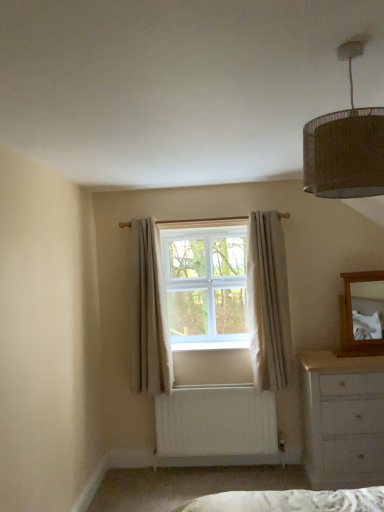
Question: Is the position of wooden mirror at right less distant than that of white plastic window at center?

Choices:
 (A) yes
 (B) no

Answer: (A)

Question: From a real-world perspective, is wooden mirror at right physically below white plastic window at center?

Choices:
 (A) yes
 (B) no

Answer: (A)

Question: Is wooden mirror at right bigger than white plastic window at center?

Choices:
 (A) no
 (B) yes

Answer: (A)

Question: Is wooden mirror at right aimed at white plastic window at center?

Choices:
 (A) no
 (B) yes

Answer: (A)

Question: Considering the relative sizes of wooden mirror at right and white plastic window at center in the image provided, is wooden mirror at right thinner than white plastic window at center?

Choices:
 (A) yes
 (B) no

Answer: (A)

Question: Is light beige fabric curtain at center, acting as the second curtain starting from the right, in front of or behind white textured curtain at center, which is counted as the 2th curtain, starting from the left, in the image?

Choices:
 (A) behind
 (B) front

Answer: (A)

Question: Looking at their shapes, would you say light beige fabric curtain at center, positioned as the 1th curtain in left-to-right order, is wider or thinner than white textured curtain at center, the first curtain viewed from the right?

Choices:
 (A) wide
 (B) thin

Answer: (A)

Question: From the image's perspective, is light beige fabric curtain at center, acting as the second curtain starting from the right, positioned above or below white textured curtain at center, which is counted as the 2th curtain, starting from the left?

Choices:
 (A) below
 (B) above

Answer: (A)

Question: Considering the positions of light beige fabric curtain at center, acting as the second curtain starting from the right, and white textured curtain at center, which is counted as the 2th curtain, starting from the left, in the image, is light beige fabric curtain at center, acting as the second curtain starting from the right, bigger or smaller than white textured curtain at center, which is counted as the 2th curtain, starting from the left,?

Choices:
 (A) small
 (B) big

Answer: (B)

Question: In the image, is braided wicker lampshade at upper right positioned in front of or behind light beige fabric curtain at center, acting as the second curtain starting from the right?

Choices:
 (A) front
 (B) behind

Answer: (A)

Question: Considering the positions of point (314, 136) and point (150, 366), is point (314, 136) closer or farther from the camera than point (150, 366)?

Choices:
 (A) closer
 (B) farther

Answer: (A)

Question: Is braided wicker lampshade at upper right inside the boundaries of light beige fabric curtain at center, positioned as the 1th curtain in left-to-right order, or outside?

Choices:
 (A) inside
 (B) outside

Answer: (B)

Question: Is braided wicker lampshade at upper right taller or shorter than light beige fabric curtain at center, acting as the second curtain starting from the right?

Choices:
 (A) short
 (B) tall

Answer: (A)

Question: Considering their positions, is white painted wood chest of drawers at lower right located in front of or behind white textured curtain at center, the first curtain viewed from the right?

Choices:
 (A) behind
 (B) front

Answer: (B)

Question: In terms of height, does white painted wood chest of drawers at lower right look taller or shorter compared to white textured curtain at center, which is counted as the 2th curtain, starting from the left?

Choices:
 (A) short
 (B) tall

Answer: (A)